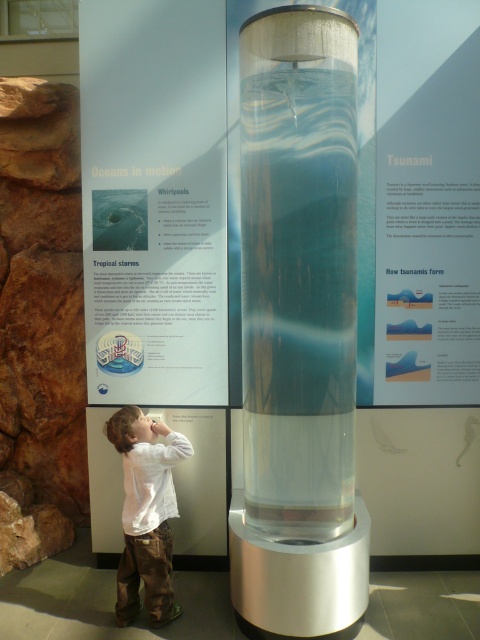
Question: In this image, where is white paper at upper right located relative to white cotton shirt at lower left?

Choices:
 (A) above
 (B) below

Answer: (A)

Question: Among these objects, which one is farthest from the camera?

Choices:
 (A) matte white poster at upper left
 (B) white cotton shirt at lower left
 (C) white paper at upper right

Answer: (A)

Question: Which of the following is the farthest from the observer?

Choices:
 (A) (471, 352)
 (B) (162, 470)
 (C) (142, 332)

Answer: (C)

Question: Which point appears farthest from the camera in this image?

Choices:
 (A) (116, 611)
 (B) (132, 124)
 (C) (396, 8)

Answer: (B)

Question: Is matte white poster at upper left below white cotton shirt at lower left?

Choices:
 (A) no
 (B) yes

Answer: (A)

Question: Is matte white poster at upper left thinner than white cotton shirt at lower left?

Choices:
 (A) no
 (B) yes

Answer: (A)